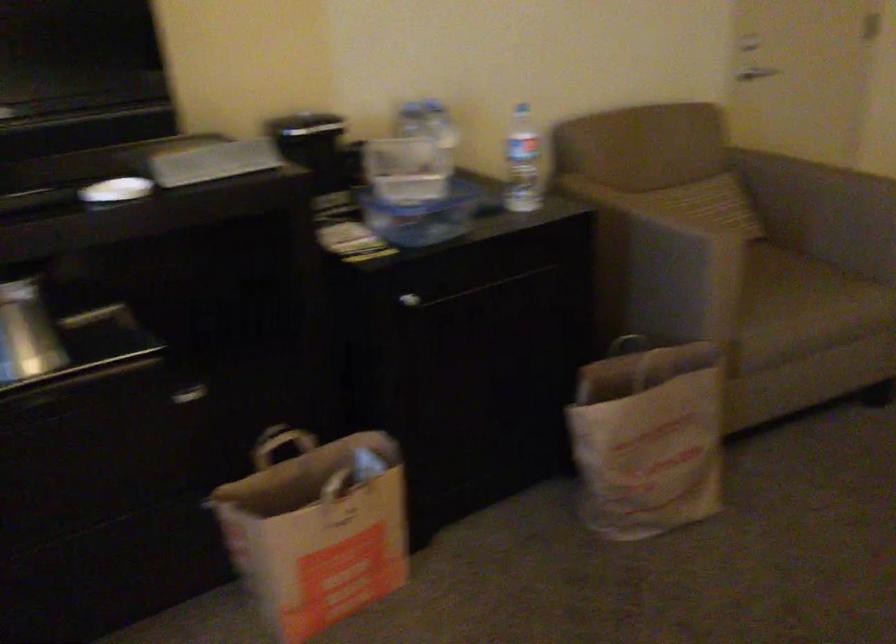
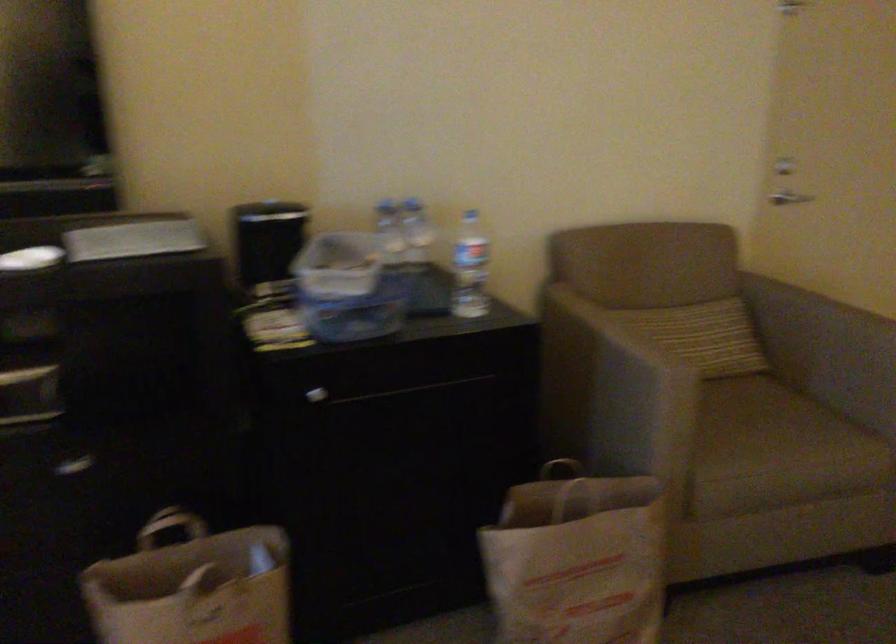
Find the pixel in the second image that matches (x=636, y=364) in the first image.

(576, 493)